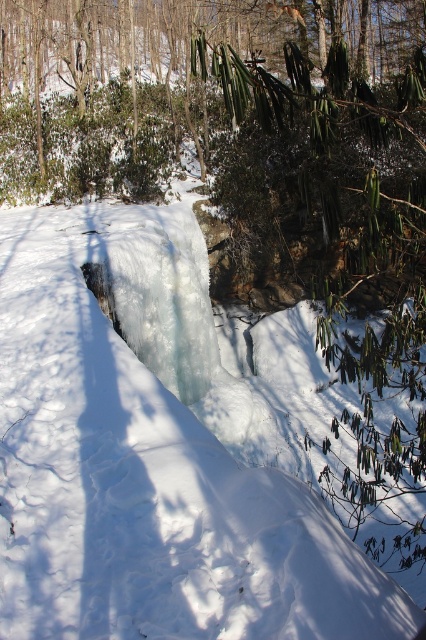
Which is more to the right, white frosty snow at center or green leafy shrub at center?

white frosty snow at center

Is point (146, 301) in front of point (336, 16)?

Yes, it is.

You are a GUI agent. You are given a task and a screenshot of the screen. Output one action in this format:
    pyautogui.click(x=<x>, y=<y>)
    Task: Click on the white frosty snow at center
    This screenshot has height=640, width=426.
    Given the screenshot: What is the action you would take?
    pyautogui.click(x=150, y=456)